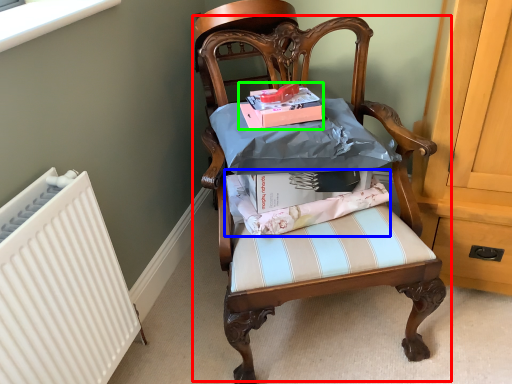
Question: Which is nearer to the chair (highlighted by a red box)? fabric (highlighted by a blue box) or magazine (highlighted by a green box).

Choices:
 (A) fabric
 (B) magazine

Answer: (A)